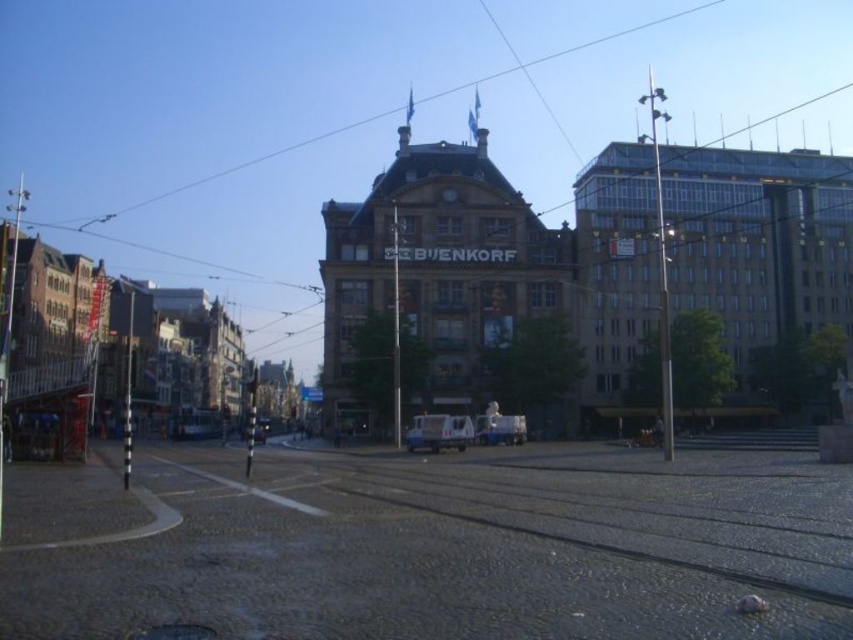
Question: Observing the image, what is the correct spatial positioning of metallic silver van at center in reference to white matte van at center?

Choices:
 (A) left
 (B) right

Answer: (A)

Question: Does metallic silver van at center have a lesser width compared to white matte truck at center?

Choices:
 (A) no
 (B) yes

Answer: (B)

Question: Which point is farther to the camera?

Choices:
 (A) (247, 426)
 (B) (405, 433)
 (C) (479, 440)

Answer: (A)

Question: Can you confirm if white matte van at center is smaller than white matte truck at center?

Choices:
 (A) yes
 (B) no

Answer: (A)

Question: Which point is closer to the camera?

Choices:
 (A) metallic silver van at center
 (B) white matte truck at center
 (C) white matte van at center

Answer: (A)

Question: Which of these objects is positioned farthest from the white matte truck at center?

Choices:
 (A) white matte van at center
 (B) metallic silver van at center

Answer: (A)